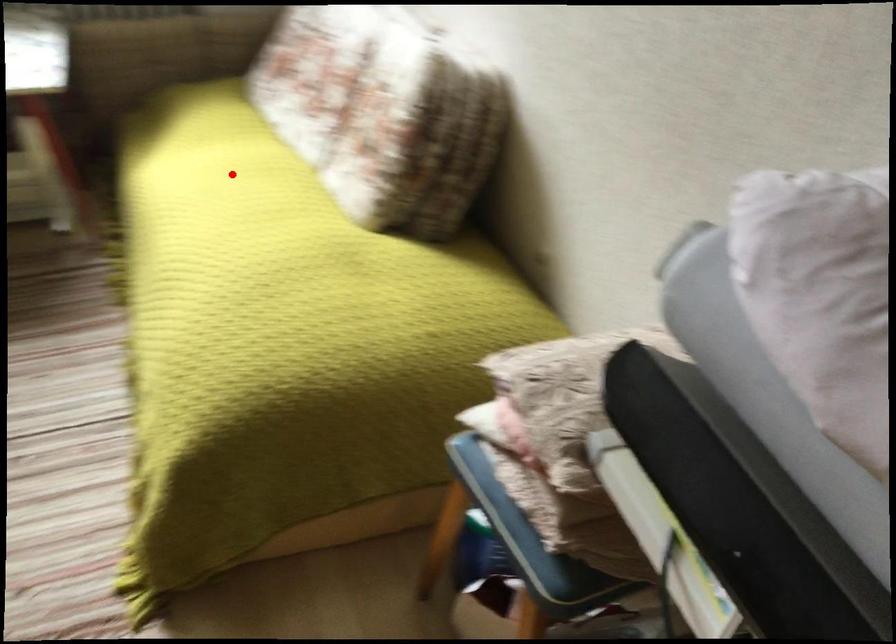
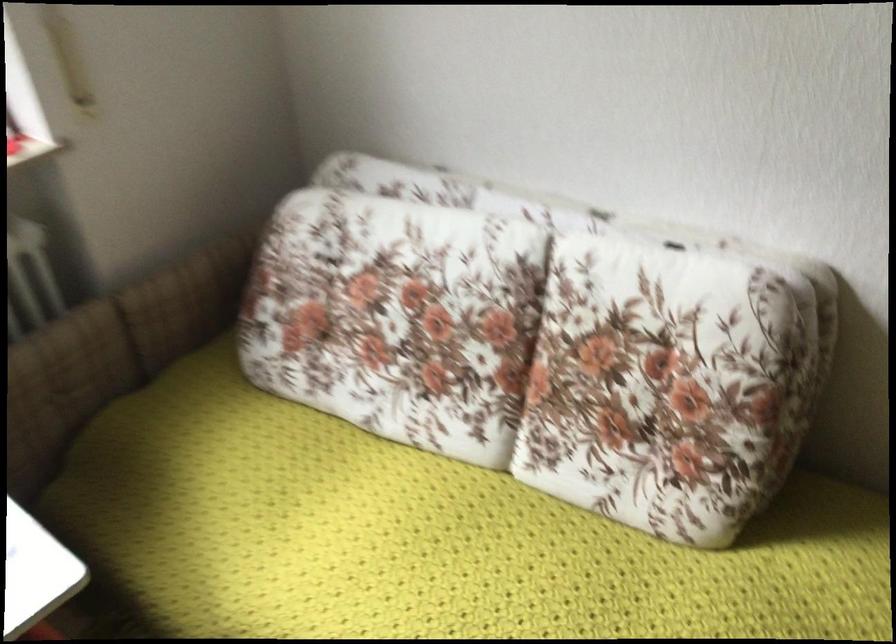
Question: I am providing you with two images of the same scene from different viewpoints. A red point is shown in image1. For the corresponding object point in image2, is it positioned nearer or farther from the camera?

Choices:
 (A) Nearer
 (B) Farther

Answer: (A)